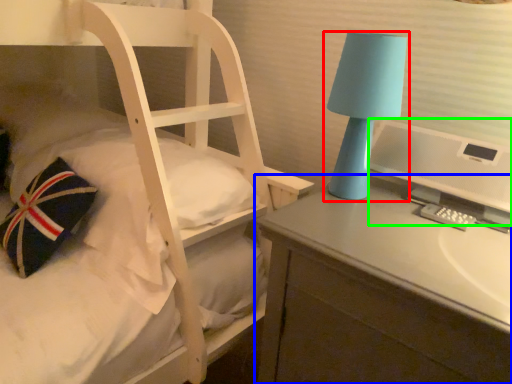
Question: Which object is positioned closest to lamp (highlighted by a red box)? Select from desk (highlighted by a blue box) and computer monitor (highlighted by a green box).

Choices:
 (A) desk
 (B) computer monitor

Answer: (B)